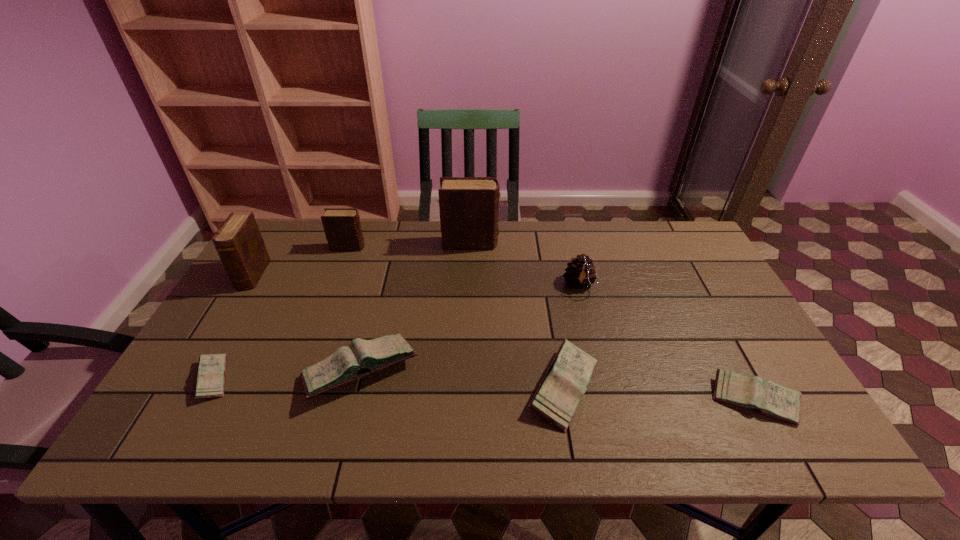
Identify the location of the third pink diary from left to right. (556, 399).

This screenshot has height=540, width=960. What are the coordinates of `the third shortest object` in the screenshot? It's located at (556, 399).

At what (x,y) coordinates should I click in order to perform the action: click on the rightmost diary. Please return your answer as a coordinate pair (x, y). The height and width of the screenshot is (540, 960). Looking at the image, I should click on (753, 393).

In order to click on the rightmost pink diary in this screenshot , I will do `click(753, 393)`.

Identify the location of the leftmost pink diary. (210, 382).

Locate an element on the screen. This screenshot has height=540, width=960. the shortest diary is located at coordinates (210, 382).

I want to click on vacant region located 0.370m on the spine side of the fifth diary from left to right, so click(611, 244).

Where is `vacant space situated on the spine side of the third farthest diary`? Image resolution: width=960 pixels, height=540 pixels. vacant space situated on the spine side of the third farthest diary is located at coordinates (180, 398).

Where is `vacant space located on the spine side of the smallest brown diary`? vacant space located on the spine side of the smallest brown diary is located at coordinates (408, 247).

What are the coordinates of `free location located with a leaf charm attached to the fourth tallest object` in the screenshot? It's located at (604, 383).